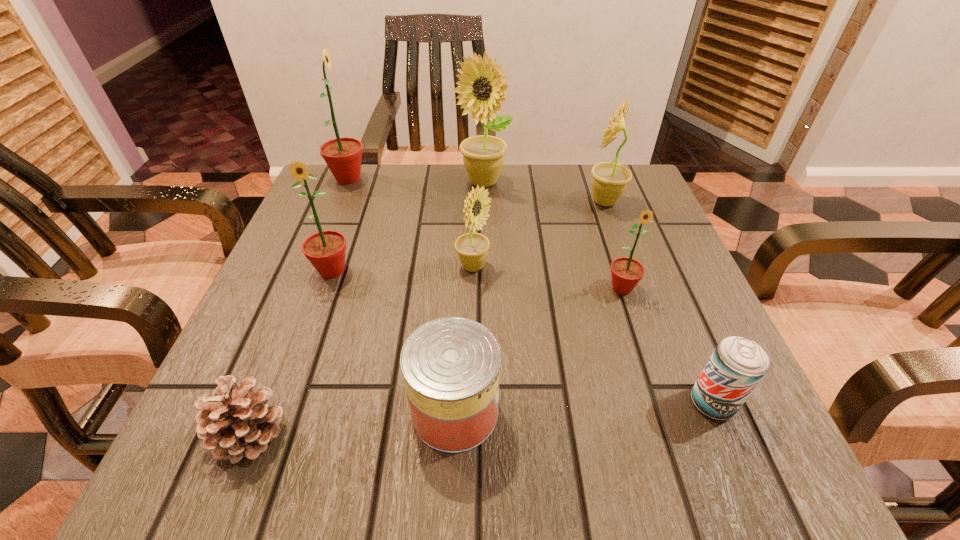
The image size is (960, 540). Identify the location of free region at the left edge of the desktop. (296, 375).

This screenshot has width=960, height=540. Find the location of `free space at the right edge of the desktop`. free space at the right edge of the desktop is located at coordinates (654, 251).

In the image, there is a desktop. At what (x,y) coordinates should I click in order to perform the action: click on free space at the far left corner. Please return your answer as a coordinate pair (x, y). Looking at the image, I should click on (325, 172).

The image size is (960, 540). What are the coordinates of `vacant area at the far right corner` in the screenshot? It's located at (612, 215).

Where is `vacant space in between the biggest yellow sunflower and the can`? vacant space in between the biggest yellow sunflower and the can is located at coordinates (468, 296).

Identify the location of vacant region between the second smallest yellow sunflower and the rightmost green sunflower. (613, 245).

You are a GUI agent. You are given a task and a screenshot of the screen. Output one action in this format:
    pyautogui.click(x=<x>, y=<y>)
    Task: Click on the empty location between the farthest green sunflower and the pinecone
    The height and width of the screenshot is (540, 960).
    Given the screenshot: What is the action you would take?
    pyautogui.click(x=299, y=306)

In order to click on free spot between the can and the biggest yellow sunflower in this screenshot , I will do `click(468, 296)`.

Where is `free space between the rightmost green sunflower and the beer can`? free space between the rightmost green sunflower and the beer can is located at coordinates (667, 346).

Where is `vacant area that lies between the nearest yellow sunflower and the smallest green sunflower`? This screenshot has width=960, height=540. vacant area that lies between the nearest yellow sunflower and the smallest green sunflower is located at coordinates (547, 278).